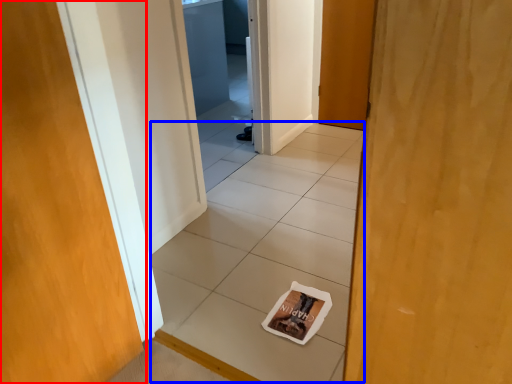
Question: Which object is closer to the camera taking this photo, door (highlighted by a red box) or tile (highlighted by a blue box)?

Choices:
 (A) door
 (B) tile

Answer: (A)